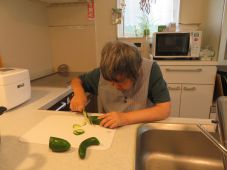
You are a GUI agent. You are given a task and a screenshot of the screen. Output one action in this format:
    pyautogui.click(x=<x>, y=<y>)
    Task: Click on the counter
    
    Given the screenshot: What is the action you would take?
    pyautogui.click(x=38, y=126)